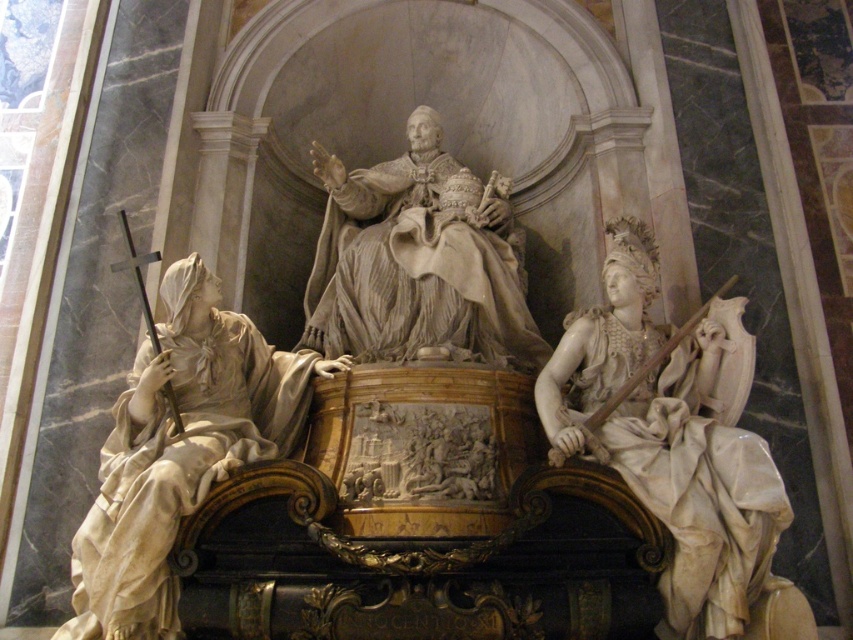
Between white marble statue at right and white marble statue at center, which one is positioned lower?

white marble statue at right is lower down.

Is white marble statue at right bigger than white marble statue at center?

Actually, white marble statue at right might be smaller than white marble statue at center.

Is point (538, 376) in front of point (412, 310)?

Yes, it is in front of point (412, 310).

The height and width of the screenshot is (640, 853). Find the location of `white marble statue at right`. white marble statue at right is located at coordinates (679, 445).

Can you confirm if matte white statue at left is shorter than white marble statue at center?

Yes.

Is matte white statue at left closer to the viewer compared to white marble statue at center?

Yes, it is.

I want to click on matte white statue at left, so click(178, 451).

Who is higher up, white marble statue at right or matte white statue at left?

Positioned higher is white marble statue at right.

Between white marble statue at right and matte white statue at left, which one appears on the right side from the viewer's perspective?

white marble statue at right

Is point (708, 582) behind point (236, 449)?

No, (708, 582) is in front of (236, 449).

Identify the location of white marble statue at right. This screenshot has width=853, height=640. (679, 445).